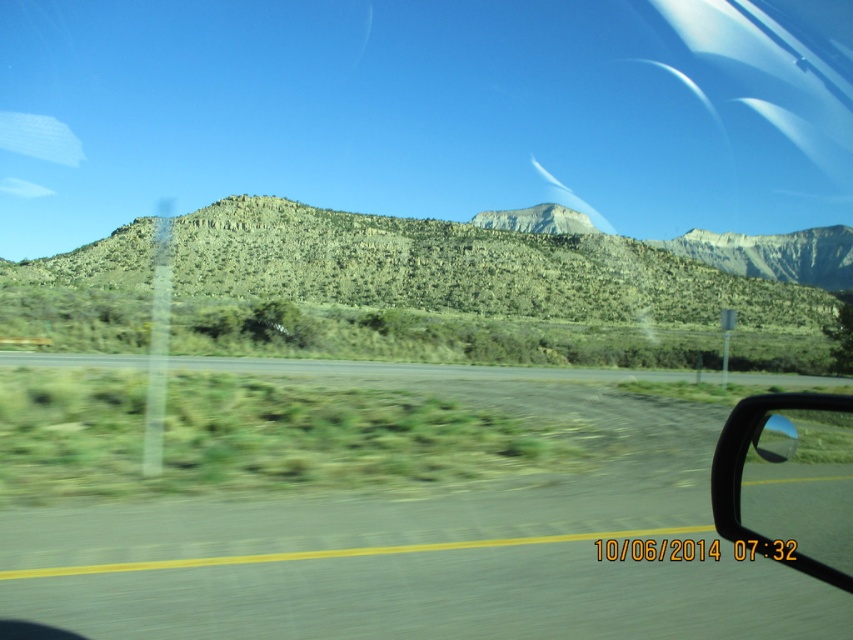
You are a driver checking your vehicle before departure. You notice the black rubber view mirror at lower right and the green grassy highway at center. Which object is narrower in width?

The black rubber view mirror at lower right is narrower in width than the green grassy highway at center.

You are a passenger in the car and looking at the black rubber view mirror at lower right and the green grassy highway at center. Which object appears smaller in the image?

The black rubber view mirror at lower right appears smaller in the image compared to the green grassy highway at center.

Based on the scene described, where exactly is the green textured hill at center located in terms of coordinates?

The green textured hill at center is located at coordinates point (465, 268).